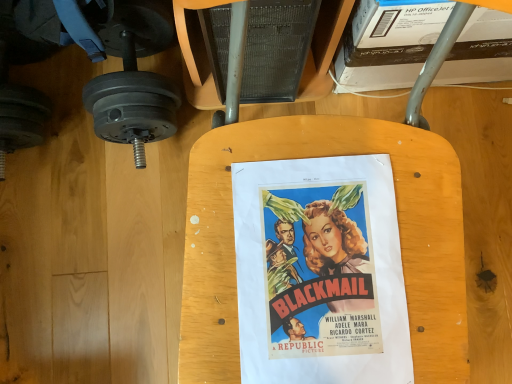
Where is `empty space that is ontop of vibrant paper poster at center (from a real-world perspective)`? This screenshot has width=512, height=384. empty space that is ontop of vibrant paper poster at center (from a real-world perspective) is located at coordinates pyautogui.click(x=318, y=277).